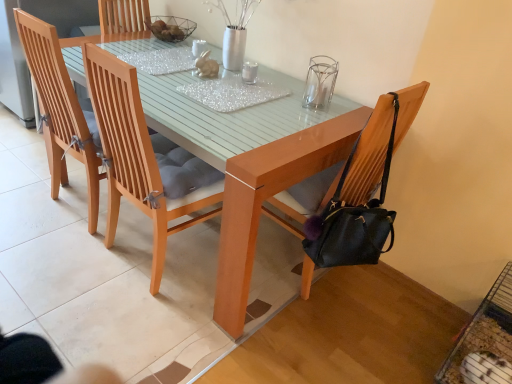
Where is `free point to the left of transparent glass candle holder at upper center`? The height and width of the screenshot is (384, 512). free point to the left of transparent glass candle holder at upper center is located at coordinates (284, 103).